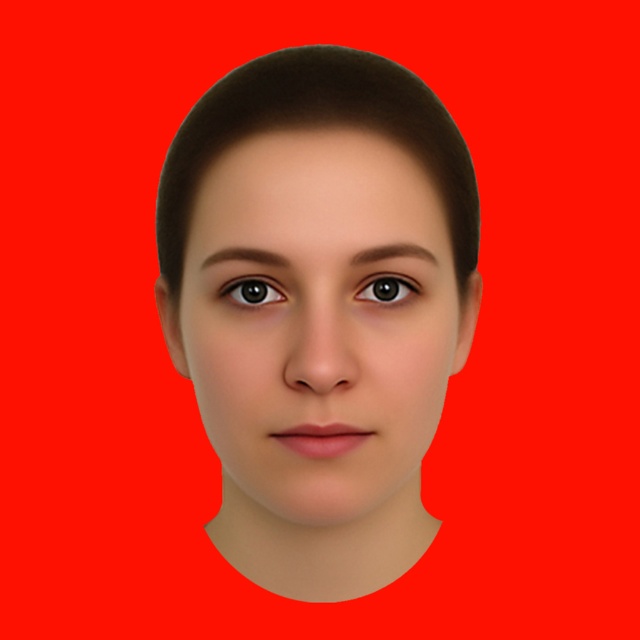
Is smooth skin face at center to the right of brown glossy eye at center from the viewer's perspective?

In fact, smooth skin face at center is to the left of brown glossy eye at center.

In the scene shown: Can you confirm if smooth skin face at center is bigger than brown glossy eye at center?

Yes, smooth skin face at center is bigger than brown glossy eye at center.

Is point (214, 369) positioned behind point (248, 300)?

No, (214, 369) is closer to viewer.

Identify the location of smooth skin face at center. The width and height of the screenshot is (640, 640). (317, 323).

Can you confirm if brown glossy eye at upper center is positioned to the right of brown glossy eye at center?

Incorrect, brown glossy eye at upper center is not on the right side of brown glossy eye at center.

Can you confirm if brown glossy eye at upper center is taller than brown glossy eye at center?

No.

Locate an element on the screen. Image resolution: width=640 pixels, height=640 pixels. brown glossy eye at upper center is located at coordinates (252, 291).

Does smooth skin face at center appear under brown glossy eye at upper center?

Indeed, smooth skin face at center is positioned under brown glossy eye at upper center.

Who is taller, smooth skin face at center or brown glossy eye at upper center?

With more height is smooth skin face at center.

Describe the element at coordinates (317, 323) in the screenshot. I see `smooth skin face at center` at that location.

At what (x,y) coordinates should I click in order to perform the action: click on smooth skin face at center. Please return your answer as a coordinate pair (x, y). The image size is (640, 640). Looking at the image, I should click on (317, 323).